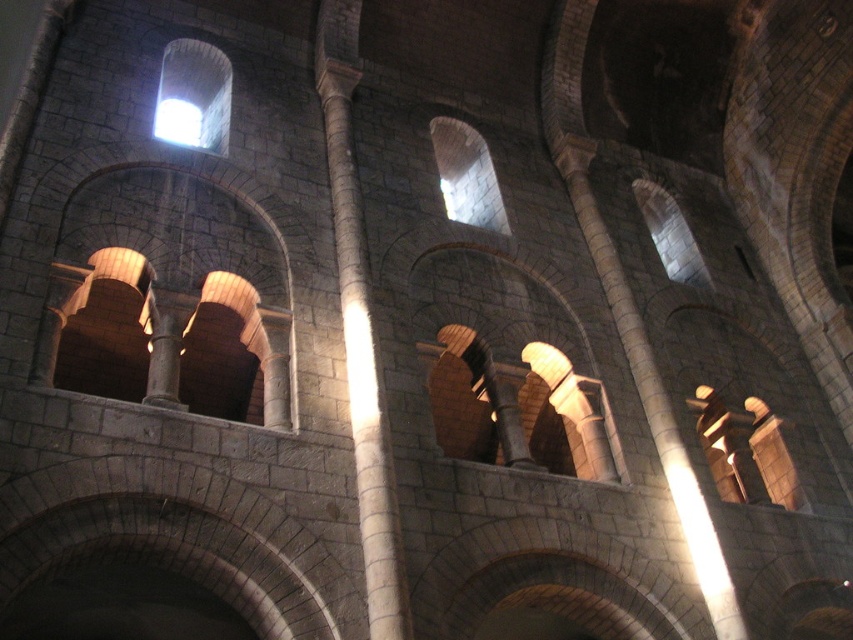
Question: Which point is farther to the camera?

Choices:
 (A) (355, 321)
 (B) (155, 108)

Answer: (B)

Question: Which point appears closest to the camera in this image?

Choices:
 (A) (166, 118)
 (B) (380, 380)

Answer: (B)

Question: Can you confirm if smooth stone column at center is positioned to the right of white glossy light at upper center?

Choices:
 (A) yes
 (B) no

Answer: (A)

Question: Does smooth stone column at center appear on the right side of white glossy light at upper center?

Choices:
 (A) yes
 (B) no

Answer: (A)

Question: Which object appears closest to the camera in this image?

Choices:
 (A) white glossy light at upper center
 (B) smooth stone column at center

Answer: (B)

Question: Does smooth stone column at center appear over white glossy light at upper center?

Choices:
 (A) yes
 (B) no

Answer: (B)